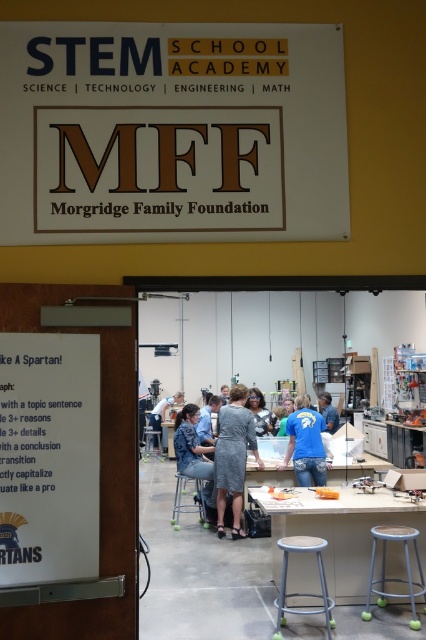
Question: Which object is closer to the camera taking this photo?

Choices:
 (A) blue shirt at center
 (B) metallic silver bar stool at center

Answer: (B)

Question: Can you confirm if metallic stool at center is positioned below gray fabric bar stool at center?

Choices:
 (A) yes
 (B) no

Answer: (B)

Question: Among these points, which one is farthest from the camera?

Choices:
 (A) (215, 406)
 (B) (322, 476)
 (C) (259, 429)
 (D) (327, 410)

Answer: (D)

Question: Which object is closer to the camera taking this photo?

Choices:
 (A) metallic silver stool at center
 (B) white matte sign at upper center
 (C) light blue denim shirt at center
 (D) white paper at left

Answer: (D)

Question: Can you confirm if metallic stool at center is positioned to the right of denim skirt at center?

Choices:
 (A) yes
 (B) no

Answer: (A)

Question: Can you confirm if light blue denim shirt at center is positioned to the left of denim skirt at center?

Choices:
 (A) no
 (B) yes

Answer: (A)